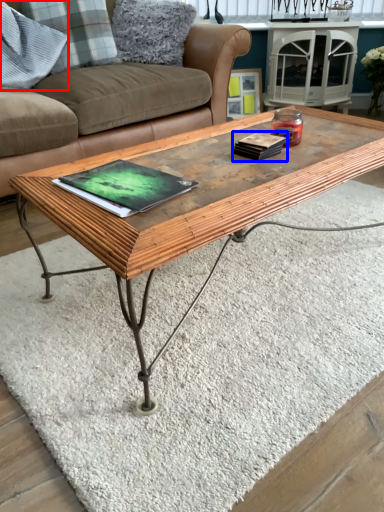
Question: Which object is further to the camera taking this photo, pillow (highlighted by a red box) or book (highlighted by a blue box)?

Choices:
 (A) pillow
 (B) book

Answer: (A)